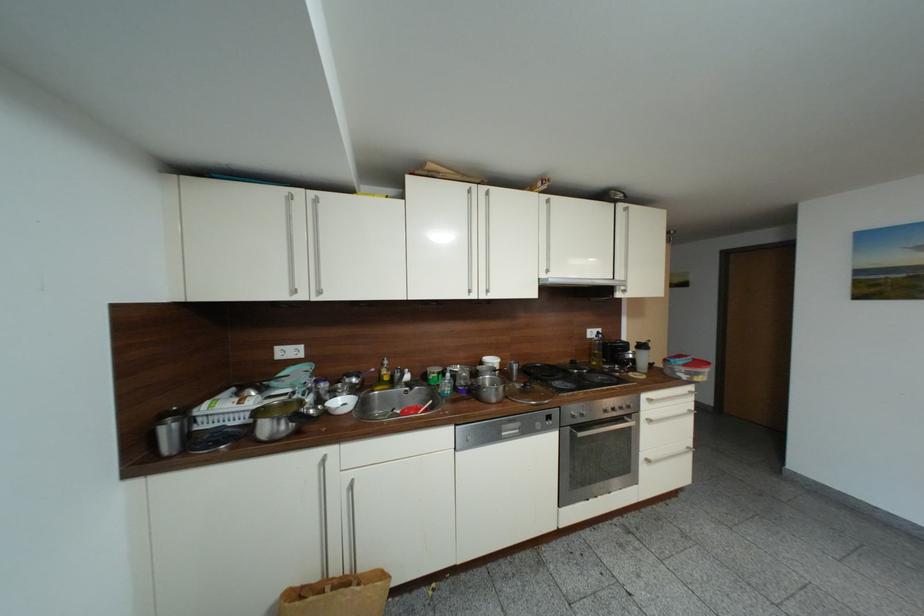
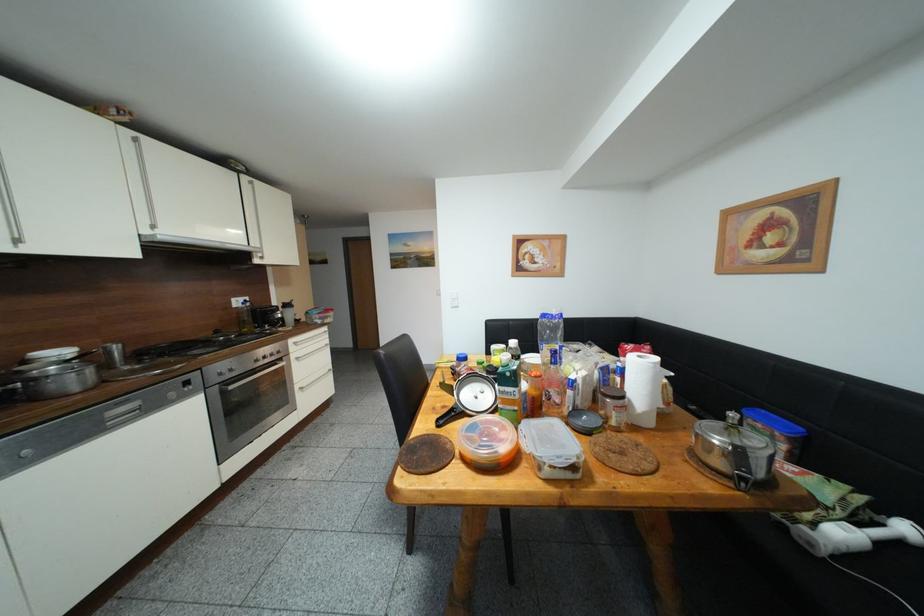
Question: The camera is either moving clockwise (left) or counter-clockwise (right) around the object. The first image is from the beginning of the video and the second image is from the end. Is the camera moving left or right when shooting the video?

Choices:
 (A) Left
 (B) Right

Answer: (A)